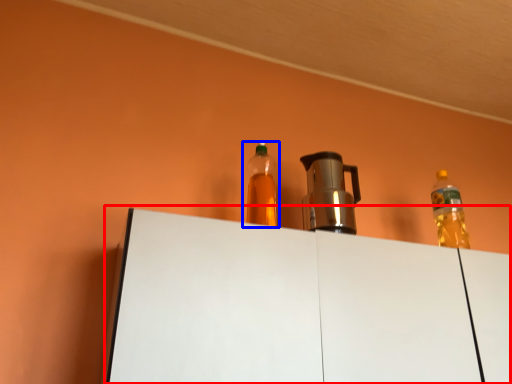
Question: Which point is closer to the camera, table (highlighted by a red box) or bottle (highlighted by a blue box)?

Choices:
 (A) table
 (B) bottle

Answer: (A)